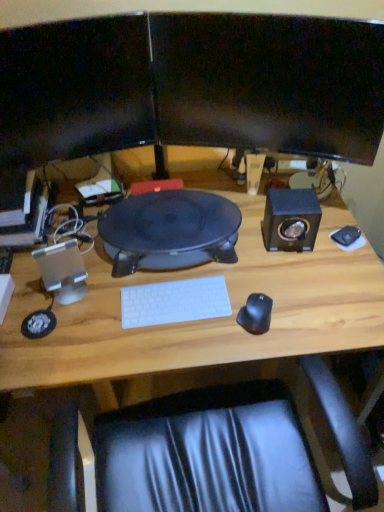
Locate an element on the screen. free space between black rubberized mouse at right, the first mouse in the left-to-right sequence, and black matte mouse at right, acting as the second mouse starting from the front is located at coordinates (302, 280).